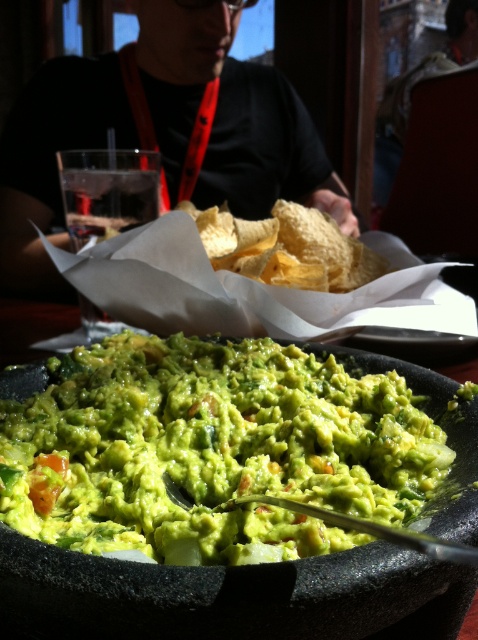
Question: Can you confirm if green creamy guacamole at center is positioned to the left of black shirt at upper center?

Choices:
 (A) no
 (B) yes

Answer: (A)

Question: Can you confirm if green creamy guacamole at center is wider than black shirt at upper center?

Choices:
 (A) no
 (B) yes

Answer: (A)

Question: Observing the image, what is the correct spatial positioning of green creamy guacamole at center in reference to black shirt at upper center?

Choices:
 (A) above
 (B) below

Answer: (B)

Question: Which object is farther from the camera taking this photo?

Choices:
 (A) black shirt at upper center
 (B) green creamy guacamole at center

Answer: (A)